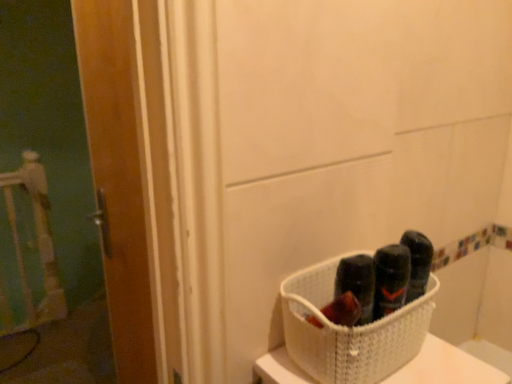
Question: Is wooden door at left smaller than white woven basket at lower right?

Choices:
 (A) yes
 (B) no

Answer: (B)

Question: Is wooden door at left not near white woven basket at lower right?

Choices:
 (A) no
 (B) yes

Answer: (A)

Question: From the image's perspective, is wooden door at left located beneath white woven basket at lower right?

Choices:
 (A) no
 (B) yes

Answer: (A)

Question: Is wooden door at left bigger than white woven basket at lower right?

Choices:
 (A) yes
 (B) no

Answer: (A)

Question: Is wooden door at left positioned with its back to white woven basket at lower right?

Choices:
 (A) no
 (B) yes

Answer: (A)

Question: Does wooden door at left come behind white woven basket at lower right?

Choices:
 (A) yes
 (B) no

Answer: (A)

Question: Is white woven basket at lower right taller than wooden door at left?

Choices:
 (A) yes
 (B) no

Answer: (B)

Question: Considering the relative sizes of white woven basket at lower right and wooden door at left in the image provided, is white woven basket at lower right thinner than wooden door at left?

Choices:
 (A) yes
 (B) no

Answer: (B)

Question: Does white woven basket at lower right come behind wooden door at left?

Choices:
 (A) no
 (B) yes

Answer: (A)

Question: Is white woven basket at lower right closer to camera compared to wooden door at left?

Choices:
 (A) yes
 (B) no

Answer: (A)

Question: Is white woven basket at lower right looking in the opposite direction of wooden door at left?

Choices:
 (A) no
 (B) yes

Answer: (B)

Question: Considering the relative sizes of white woven basket at lower right and wooden door at left in the image provided, is white woven basket at lower right shorter than wooden door at left?

Choices:
 (A) no
 (B) yes

Answer: (B)

Question: Do you think wooden door at left is within white woven basket at lower right, or outside of it?

Choices:
 (A) inside
 (B) outside

Answer: (B)